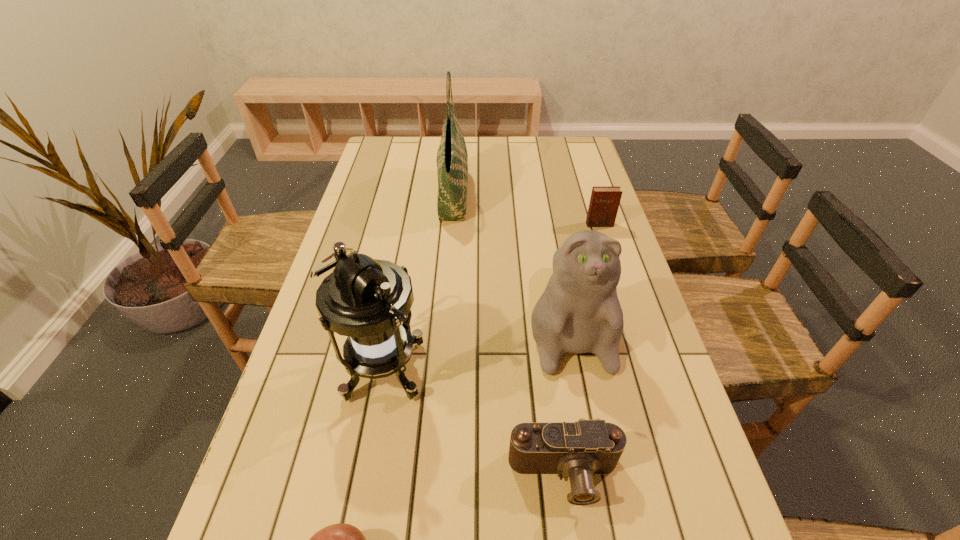
At what (x,y) coordinates should I click in order to perform the action: click on vacant space at the far right corner of the desktop. Please return your answer as a coordinate pair (x, y). The height and width of the screenshot is (540, 960). Looking at the image, I should click on (578, 141).

This screenshot has width=960, height=540. Find the location of `free point between the fourth shortest object and the camera`. free point between the fourth shortest object and the camera is located at coordinates (566, 395).

Locate an element on the screen. free space between the tote bag and the second shortest object is located at coordinates (509, 335).

Locate an element on the screen. This screenshot has width=960, height=540. free space that is in between the tote bag and the fourth tallest object is located at coordinates (526, 210).

The image size is (960, 540). Identify the location of unoccupied position between the tote bag and the lantern. (417, 280).

You are a GUI agent. You are given a task and a screenshot of the screen. Output one action in this format:
    pyautogui.click(x=<x>, y=<y>)
    Task: Click on the object that is the fourth closest to the tote bag
    Image resolution: width=960 pixels, height=540 pixels.
    Given the screenshot: What is the action you would take?
    pyautogui.click(x=579, y=449)

What are the coordinates of `object that is the third closest to the cat` in the screenshot? It's located at (452, 158).